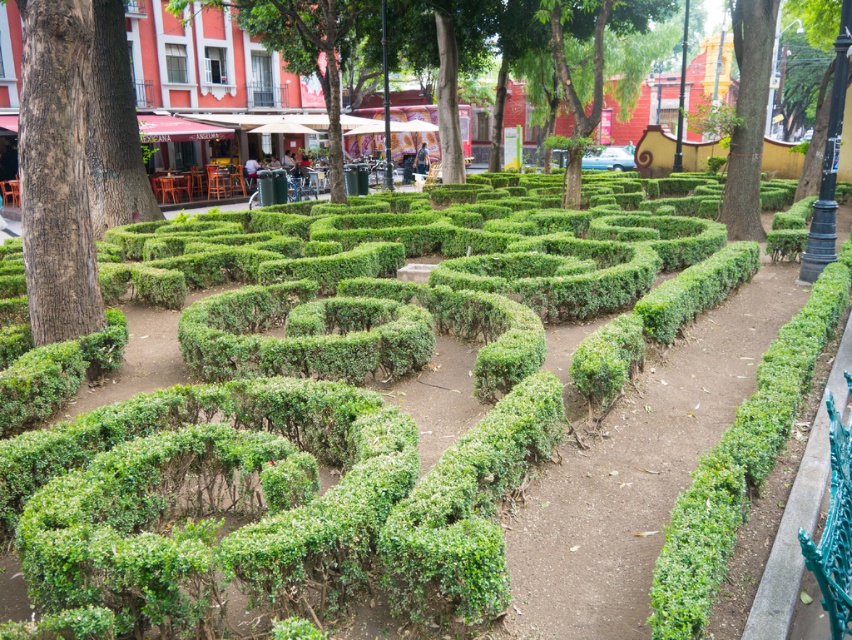
From the picture: Is green leafy tree at upper center further to the viewer compared to green leafy tree at upper right?

Yes, it is.

Does green leafy tree at upper center have a smaller size compared to green leafy tree at upper right?

No, green leafy tree at upper center is not smaller than green leafy tree at upper right.

Is point (554, 54) behind point (753, 170)?

Yes, it is.

You are a GUI agent. You are given a task and a screenshot of the screen. Output one action in this format:
    pyautogui.click(x=<x>, y=<y>)
    Task: Click on the green leafy tree at upper center
    The width and height of the screenshot is (852, 640).
    Given the screenshot: What is the action you would take?
    pyautogui.click(x=602, y=58)

Does brown textured tree trunk at left appear under green leafy tree at upper right?

Indeed, brown textured tree trunk at left is positioned under green leafy tree at upper right.

Is point (76, 76) in front of point (735, 205)?

Yes, it is in front of point (735, 205).

Locate an element on the screen. brown textured tree trunk at left is located at coordinates (56, 170).

Which is more to the right, brown textured tree trunk at left or green leafy tree at upper center?

Positioned to the right is green leafy tree at upper center.

Is point (29, 74) in front of point (576, 93)?

Yes.

This screenshot has width=852, height=640. What are the coordinates of `brown textured tree trunk at left` in the screenshot? It's located at (56, 170).

Identify the location of brown textured tree trunk at left. This screenshot has height=640, width=852. [x=56, y=170].